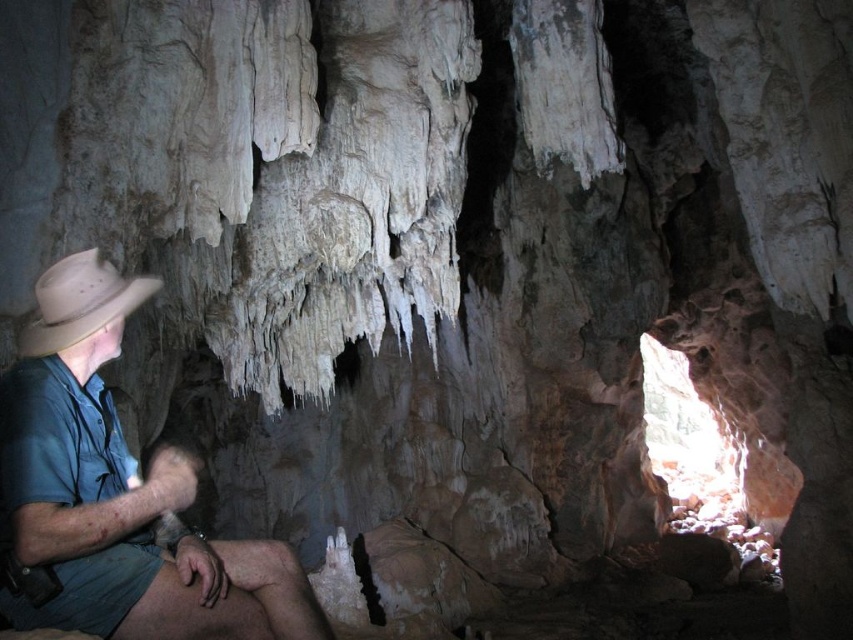
Question: Can you confirm if light brown leather hat at left is positioned to the right of beige felt fedora at left?

Choices:
 (A) yes
 (B) no

Answer: (A)

Question: Is light brown leather hat at left smaller than beige felt fedora at left?

Choices:
 (A) no
 (B) yes

Answer: (A)

Question: Can you confirm if light brown leather hat at left is positioned to the left of beige felt fedora at left?

Choices:
 (A) no
 (B) yes

Answer: (A)

Question: Which object appears closest to the camera in this image?

Choices:
 (A) beige felt fedora at left
 (B) light brown leather hat at left

Answer: (B)